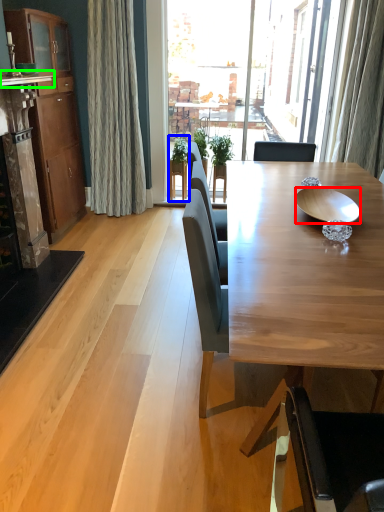
Question: Which object is positioned closest to bowl (highlighted by a red box)? Select from houseplant (highlighted by a blue box) and counter top (highlighted by a green box).

Choices:
 (A) houseplant
 (B) counter top

Answer: (B)